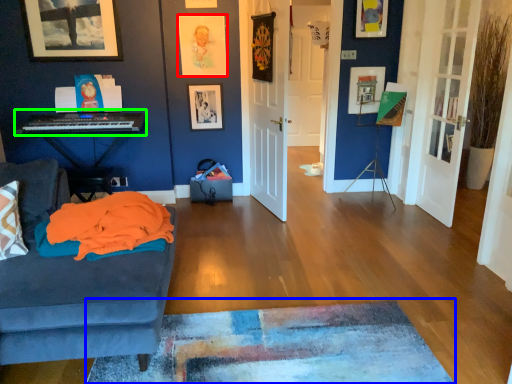
Question: Considering the real-world distances, which object is farthest from picture frame (highlighted by a red box)? plain (highlighted by a blue box) or musical keyboard (highlighted by a green box)?

Choices:
 (A) plain
 (B) musical keyboard

Answer: (A)